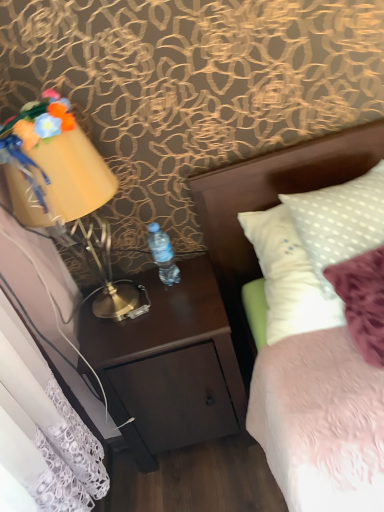
Locate an element on the screen. vacant space to the right of matte yellow lampshade at left is located at coordinates (186, 291).